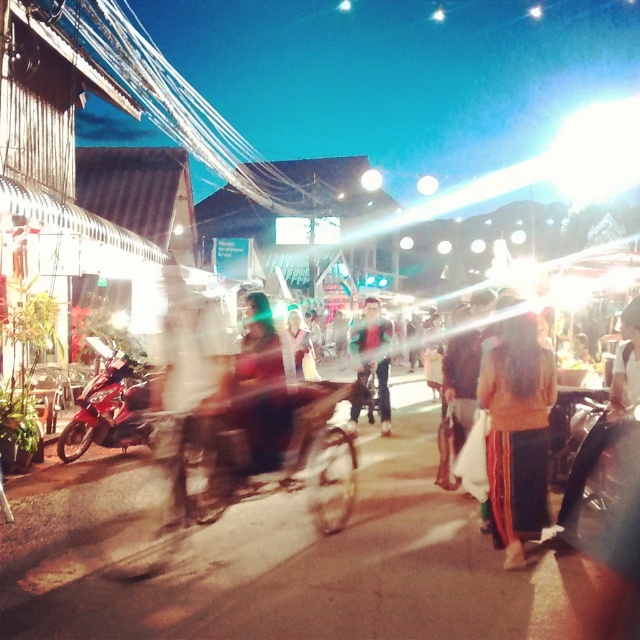
Who is more forward, (509, 449) or (131, 412)?

Point (509, 449)

Does brown fabric skirt at center lie behind shiny red motorcycle at left?

No.

Who is more forward, (520, 474) or (99, 413)?

Point (520, 474)

Locate an element on the screen. Image resolution: width=640 pixels, height=640 pixels. brown fabric skirt at center is located at coordinates coord(516,433).

Who is shorter, shiny red motorcycle at left or dark blue jeans at center?

With less height is shiny red motorcycle at left.

Is shiny red motorcycle at left below dark blue jeans at center?

Correct, shiny red motorcycle at left is located below dark blue jeans at center.

Who is more distant from viewer, (128,372) or (368,362)?

Point (368,362)

Find the location of a particular element. This screenshot has width=640, height=640. shiny red motorcycle at left is located at coordinates (112, 404).

Is brown fabric skirt at center smaller than dark blue jeans at center?

Yes, brown fabric skirt at center is smaller than dark blue jeans at center.

Between point (499, 522) and point (362, 326), which one is positioned behind?

Point (362, 326)

Find the location of a particular element. The width and height of the screenshot is (640, 640). brown fabric skirt at center is located at coordinates 516,433.